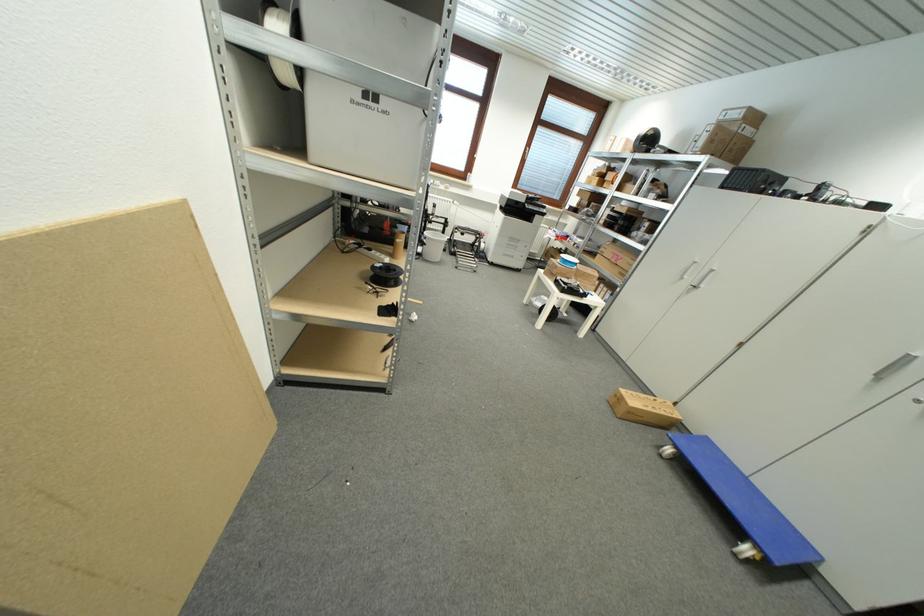
The location [746,503] corresponds to which object?

It refers to a blue filament spool.